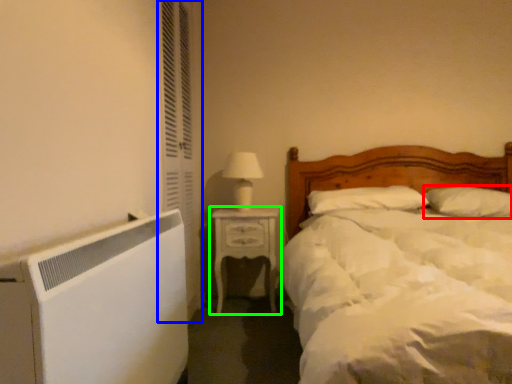
Question: Considering the real-world distances, which object is closest to pillow (highlighted by a red box)? screen door (highlighted by a blue box) or nightstand (highlighted by a green box).

Choices:
 (A) screen door
 (B) nightstand

Answer: (B)